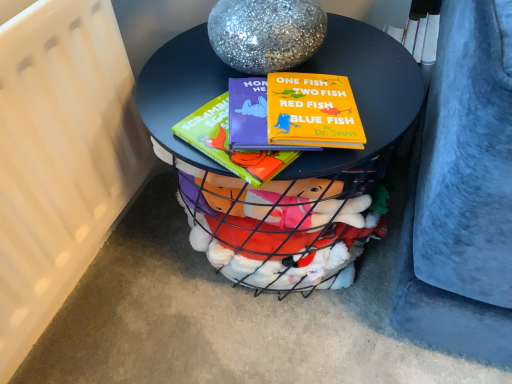
Question: Is matte black table at center positioned in front of white matte radiator at left?

Choices:
 (A) yes
 (B) no

Answer: (B)

Question: From the image's perspective, would you say matte black table at center is positioned over white matte radiator at left?

Choices:
 (A) yes
 (B) no

Answer: (B)

Question: Are matte black table at center and white matte radiator at left far apart?

Choices:
 (A) no
 (B) yes

Answer: (A)

Question: Can you confirm if matte black table at center is thinner than white matte radiator at left?

Choices:
 (A) yes
 (B) no

Answer: (B)

Question: Does matte black table at center appear on the left side of white matte radiator at left?

Choices:
 (A) yes
 (B) no

Answer: (B)

Question: Can you confirm if matte black table at center is positioned to the right of white matte radiator at left?

Choices:
 (A) no
 (B) yes

Answer: (B)

Question: Considering the relative sizes of white matte radiator at left and matte black table at center in the image provided, is white matte radiator at left bigger than matte black table at center?

Choices:
 (A) yes
 (B) no

Answer: (B)

Question: Is the depth of white matte radiator at left greater than that of matte black table at center?

Choices:
 (A) no
 (B) yes

Answer: (A)

Question: From the image's perspective, does white matte radiator at left appear lower than matte black table at center?

Choices:
 (A) no
 (B) yes

Answer: (A)

Question: Considering the relative positions of white matte radiator at left and matte black table at center in the image provided, is white matte radiator at left to the right of matte black table at center from the viewer's perspective?

Choices:
 (A) no
 (B) yes

Answer: (A)

Question: Is matte black table at center completely or partially inside white matte radiator at left?

Choices:
 (A) no
 (B) yes

Answer: (A)

Question: From a real-world perspective, is white matte radiator at left located beneath matte black table at center?

Choices:
 (A) no
 (B) yes

Answer: (A)

Question: In terms of height, does matte black table at center look taller or shorter compared to white matte radiator at left?

Choices:
 (A) short
 (B) tall

Answer: (A)